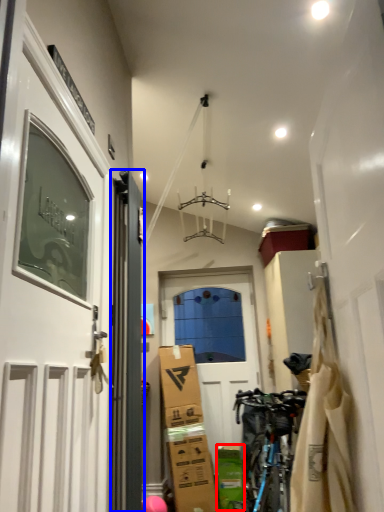
Question: Which object is further to the camera taking this photo, cardboard box (highlighted by a red box) or door (highlighted by a blue box)?

Choices:
 (A) cardboard box
 (B) door

Answer: (A)